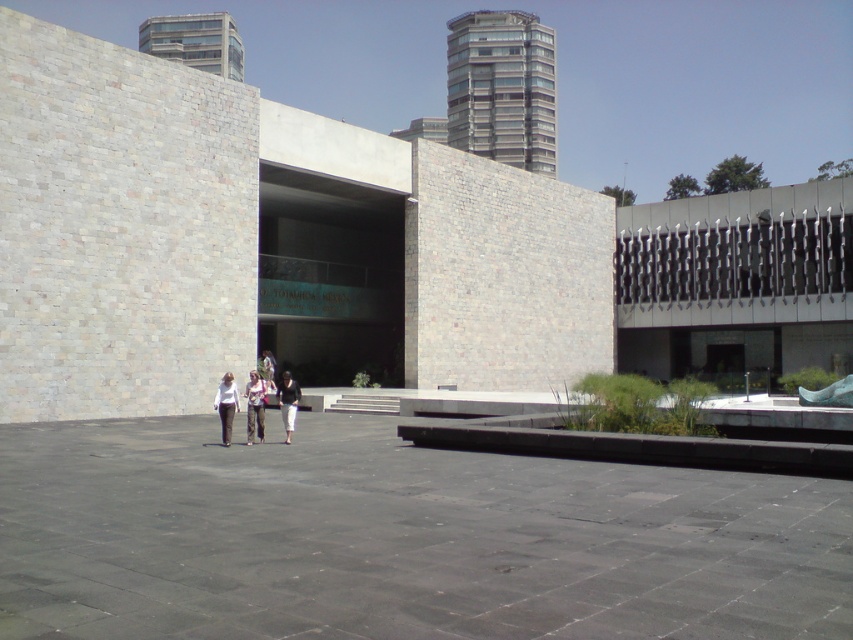
You are standing at the entrance of the modern architectural structure and see two points marked on the paved area in front of you. The first point is labeled as point (289, 403) and the second is point (268, 368). If you want to walk towards the point that is closer to the building, which point should you head towards?

Point (268, 368) is closer to the building, so you should head towards point (268, 368).

You are an architect designing a new building and want to ensure that the black concrete courtyard at center is visually dominant over the black matte pants at center. Based on the scene description, does the current layout achieve this goal?

Yes, the black concrete courtyard at center has a larger size compared to black matte pants at center, making it visually dominant.

In the scene shown: You are an architect designing a new building. You need to ensure that the black concrete courtyard at center is visible from above the black matte pants at center. Based on their heights, is this possible?

The black concrete courtyard at center has a lesser height compared to black matte pants at center, so it is possible to see the courtyard from above the pants since the courtyard is lower.